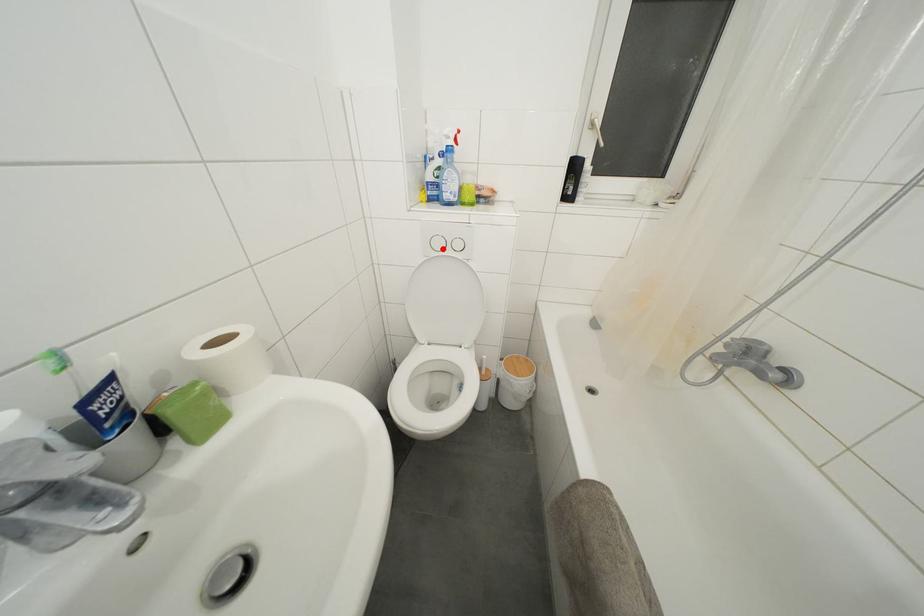
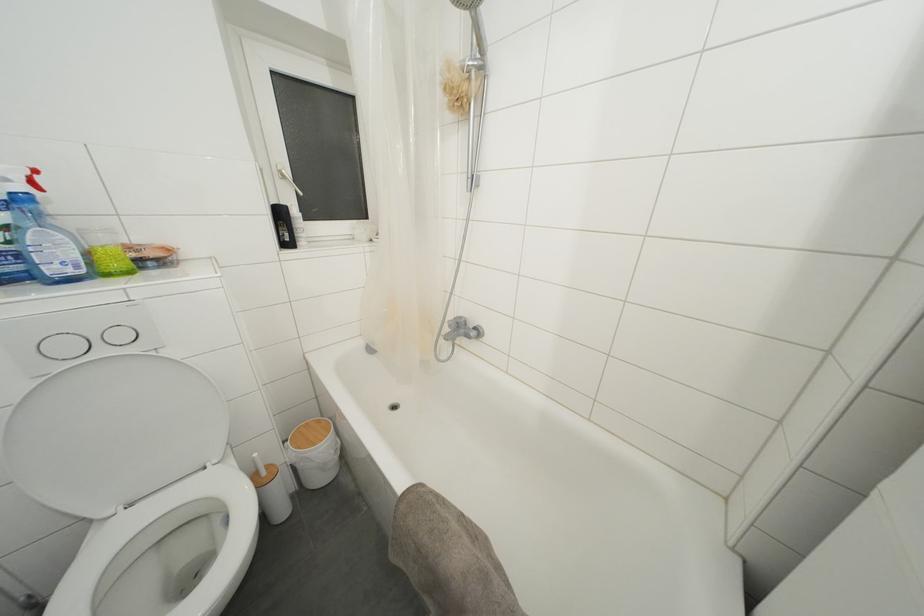
In the second image, find the point that corresponds to the highlighted location in the first image.

(71, 352)